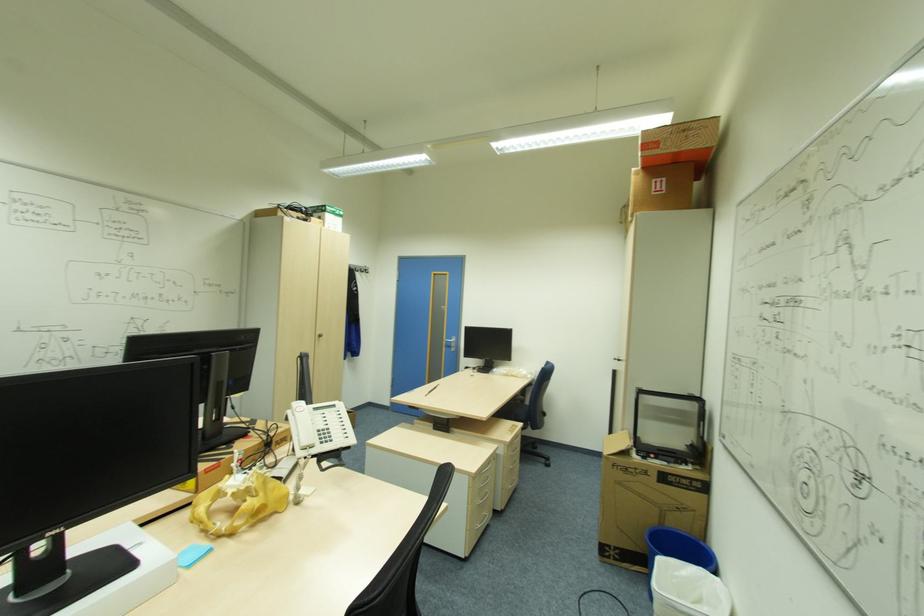
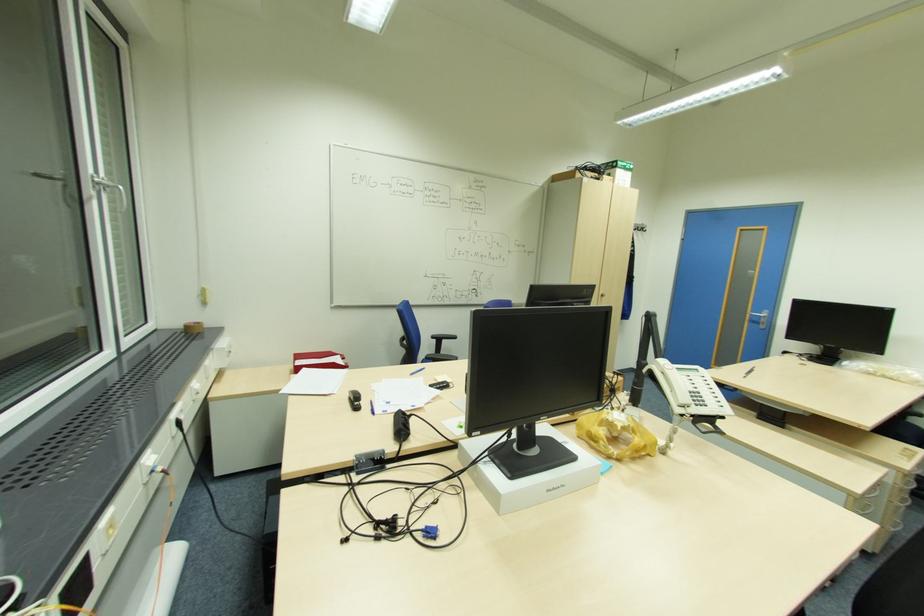
Question: How did the camera likely rotate?

Choices:
 (A) Left
 (B) Right
 (C) Up
 (D) Down

Answer: (A)